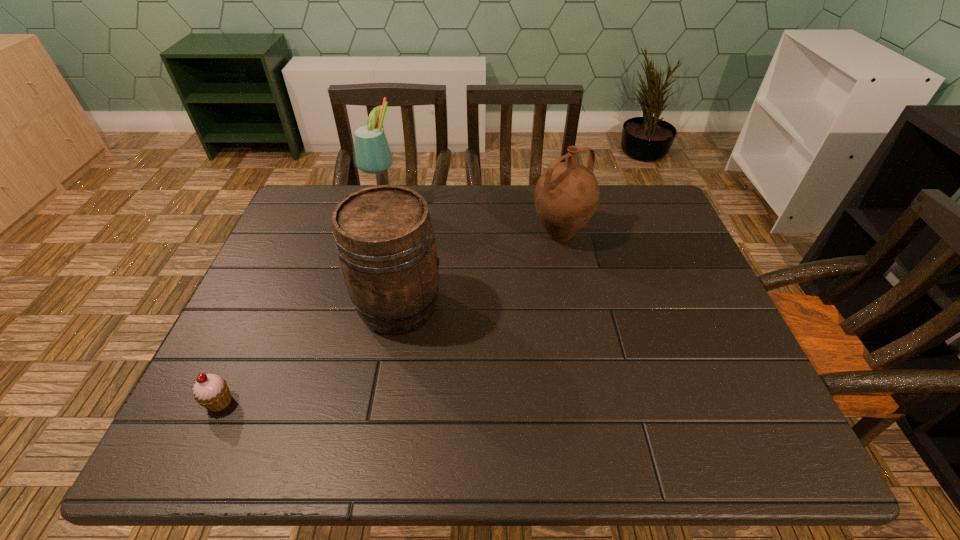
The height and width of the screenshot is (540, 960). What are the coordinates of `the tallest object` in the screenshot? It's located at (x=372, y=153).

Where is `cider`? cider is located at coordinates tap(384, 238).

This screenshot has height=540, width=960. Identify the location of pitcher. (566, 195).

In order to click on cupcake in this screenshot , I will do `click(211, 391)`.

Identify the location of the nearest object. The image size is (960, 540). (211, 391).

At what (x,y) coordinates should I click in order to perform the action: click on free space located on the left of the alcohol. Please return your answer as a coordinate pair (x, y). This screenshot has width=960, height=540. Looking at the image, I should click on (343, 209).

Locate an element on the screen. The height and width of the screenshot is (540, 960). vacant space located 0.160m on the side of the cider near the bung hole is located at coordinates (510, 307).

The width and height of the screenshot is (960, 540). I want to click on vacant region located 0.130m on the left of the pitcher, so click(485, 234).

You are a GUI agent. You are given a task and a screenshot of the screen. Output one action in this format:
    pyautogui.click(x=<x>, y=<y>)
    Task: Click on the vacant area located on the back of the shortest object
    This screenshot has width=960, height=540.
    Given the screenshot: What is the action you would take?
    pyautogui.click(x=255, y=323)

Locate an element on the screen. This screenshot has height=540, width=960. alcohol that is at the far edge is located at coordinates (372, 153).